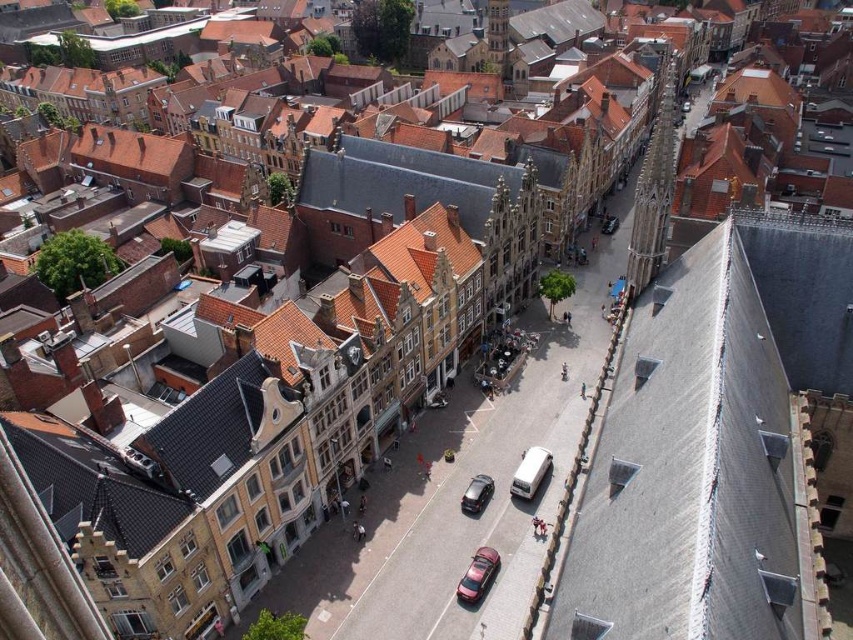
You are standing at the point marked as point (531, 472) in the image. What object are you standing on?

You are standing on the white matte van at center right.